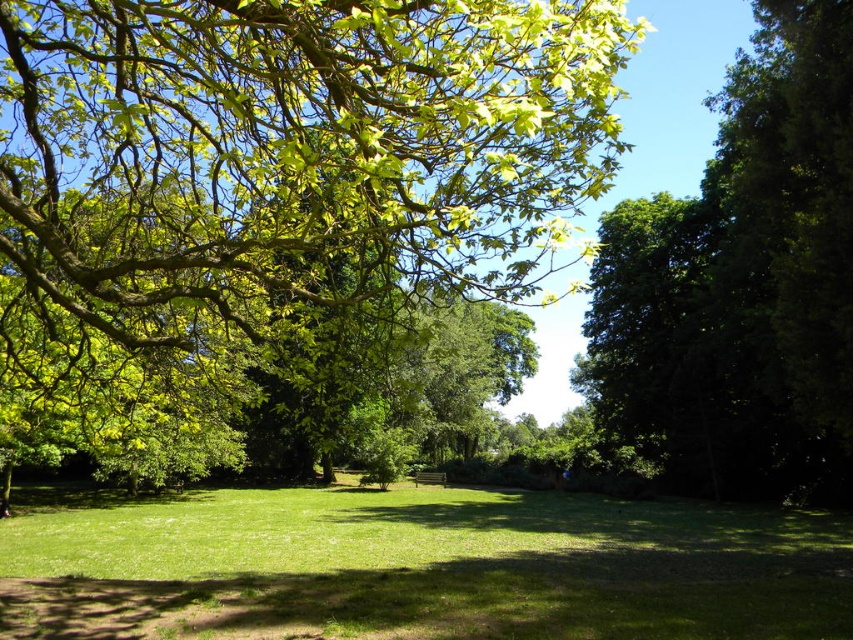
Which is above, green leafy tree at upper center or dark green leafy tree at right?

green leafy tree at upper center is above.

Looking at this image, is green leafy tree at upper center bigger than dark green leafy tree at right?

No.

Which is in front, point (231, 138) or point (685, 426)?

Positioned in front is point (231, 138).

This screenshot has height=640, width=853. Identify the location of green leafy tree at upper center. (289, 157).

Who is lower down, green grassy field at center or dark green leafy tree at right?

green grassy field at center is lower down.

Is point (479, 620) closer to viewer compared to point (834, 1)?

Yes, point (479, 620) is in front of point (834, 1).

Does point (495, 497) lie in front of point (639, 257)?

That is True.

This screenshot has width=853, height=640. I want to click on green grassy field at center, so click(x=418, y=566).

Looking at this image, does green leafy tree at upper center have a larger size compared to green grassy field at center?

No, green leafy tree at upper center is not bigger than green grassy field at center.

From the picture: Does green leafy tree at upper center have a greater width compared to green grassy field at center?

No, green leafy tree at upper center is not wider than green grassy field at center.

Which is behind, point (271, 252) or point (721, 524)?

Point (721, 524)

Locate an element on the screen. Image resolution: width=853 pixels, height=640 pixels. green leafy tree at upper center is located at coordinates (289, 157).